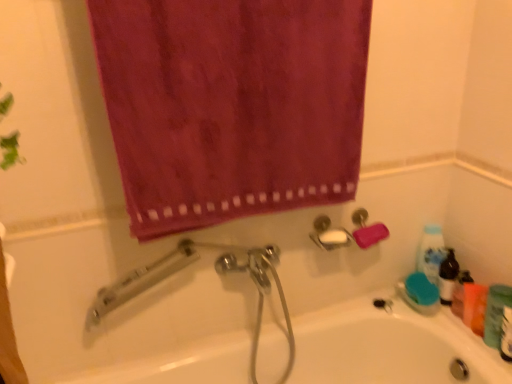
Question: Does blue glossy bottle at right have a lesser width compared to orange matte bottle at right, the first mouthwash from the back?

Choices:
 (A) yes
 (B) no

Answer: (B)

Question: Can you confirm if blue glossy bottle at right is taller than orange matte bottle at right, marked as the first mouthwash in a left-to-right arrangement?

Choices:
 (A) no
 (B) yes

Answer: (B)

Question: From a real-world perspective, is blue glossy bottle at right on orange matte bottle at right, which is the 2th mouthwash in front-to-back order?

Choices:
 (A) no
 (B) yes

Answer: (B)

Question: Is blue glossy bottle at right to the right of orange matte bottle at right, marked as the first mouthwash in a left-to-right arrangement, from the viewer's perspective?

Choices:
 (A) no
 (B) yes

Answer: (A)

Question: Is blue glossy bottle at right aimed at orange matte bottle at right, marked as the first mouthwash in a left-to-right arrangement?

Choices:
 (A) yes
 (B) no

Answer: (A)

Question: Can you confirm if blue glossy bottle at right is shorter than orange matte bottle at right, the second mouthwash in the right-to-left sequence?

Choices:
 (A) no
 (B) yes

Answer: (A)

Question: Does orange matte bottle at right, which is the 2th mouthwash in front-to-back order, have a smaller size compared to green plastic mouthwash at lower right, the second mouthwash from the back?

Choices:
 (A) yes
 (B) no

Answer: (A)

Question: From the image's perspective, is orange matte bottle at right, the first mouthwash from the back, under green plastic mouthwash at lower right, the second mouthwash from the back?

Choices:
 (A) yes
 (B) no

Answer: (B)

Question: Is green plastic mouthwash at lower right, the 1th mouthwash from the front, located within orange matte bottle at right, marked as the first mouthwash in a left-to-right arrangement?

Choices:
 (A) no
 (B) yes

Answer: (A)

Question: Can you confirm if orange matte bottle at right, which is the 2th mouthwash in front-to-back order, is shorter than green plastic mouthwash at lower right, the second mouthwash from the back?

Choices:
 (A) no
 (B) yes

Answer: (B)

Question: Can you confirm if orange matte bottle at right, marked as the first mouthwash in a left-to-right arrangement, is taller than green plastic mouthwash at lower right, which is counted as the first mouthwash, starting from the right?

Choices:
 (A) no
 (B) yes

Answer: (A)

Question: From a real-world perspective, does orange matte bottle at right, the first mouthwash from the back, stand above green plastic mouthwash at lower right, the 1th mouthwash from the front?

Choices:
 (A) yes
 (B) no

Answer: (B)

Question: Would you consider velvet-like magenta towel at upper center to be distant from green matte bottle at lower right?

Choices:
 (A) yes
 (B) no

Answer: (B)